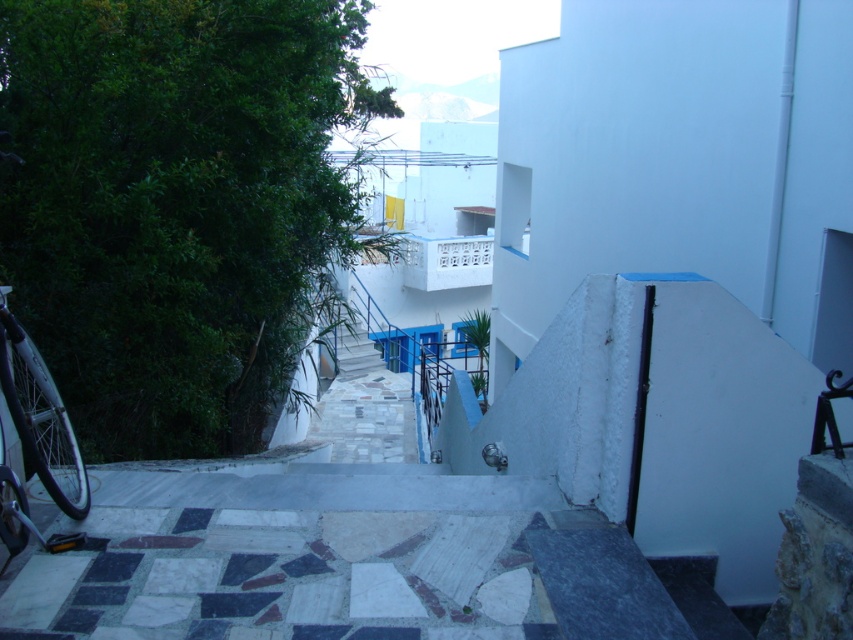
You are standing at the entrance of the white building with blue accents and looking down the narrow pathway. There are two points marked on the ground ahead of you. One is at coordinates point (62, 404) and the other is at point (343, 445). Which point is closer to you?

Point (62, 404) is closer to the viewer than point (343, 445).

You are a delivery person needing to access the white marble stairs at center to deliver a package. However, there is a silver metallic bicycle at left blocking the path. Can you still reach the stairs?

The silver metallic bicycle at left is positioned over white marble stairs at center, so the bicycle is blocking the stairs. You will need to move the bicycle to access the stairs.